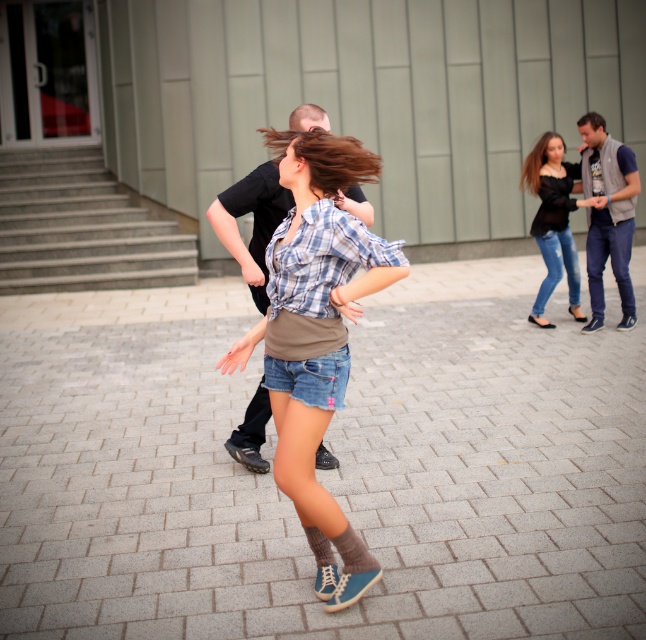
You are standing at the base of the gray concrete stairs at upper left. You want to reach the top of the stairs, which is 41.29 feet away. If you can climb one step every 2 seconds, and each step is 0.5 feet high, how many seconds will it take you to reach the top?

The gray concrete stairs at upper left are 41.29 feet away from the viewer. Each step is 0.5 feet high, so the total number of steps is 41.29 divided by 0.5, which equals approximately 82.58 steps. Since you can climb one step every 2 seconds, the total time required is 82.58 multiplied by 2, resulting in approximately 165.16 seconds. Therefore, it will take roughly 165 seconds to reach the top.

You are a photographer standing in the scene and want to capture a photo of the gray brick pavement at center and the blonde silky hair at upper right. Which object should you focus on first to ensure both are in sharp focus?

You should focus on the gray brick pavement at center first because it is closer to the viewer than the blonde silky hair at upper right, ensuring both will be in focus when using depth of field appropriately.